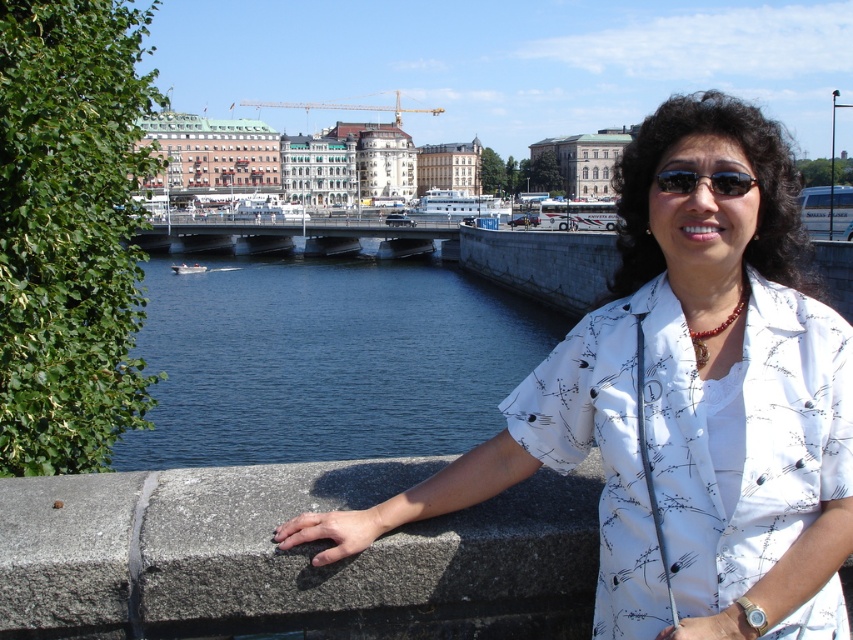
You are a photographer trying to capture the woman in the scene. You want to ensure that both the white printed blouse at center and the blue water at center are clearly visible in your photo. Given that your camera has a maximum focus range of 40 meters, will you be able to capture both objects in focus simultaneously?

The white printed blouse at center and blue water at center are 40.31 meters apart from each other. Since the distance between them exceeds the camera maximum focus range of 40 meters, you cannot capture both objects in focus simultaneously.

You are a photographer trying to capture the woman in the scene. You notice the blue water at center and the black reflective sunglasses at center. Which object is wider in the image?

The blue water at center is wider than the black reflective sunglasses at center.